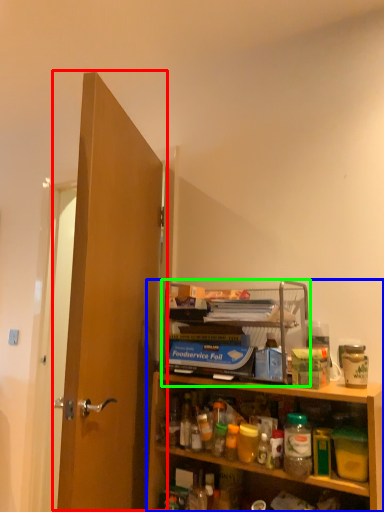
Question: Based on their relative distances, which object is farther from door (highlighted by a red box)? Choose from cabinetry (highlighted by a blue box) and shelf (highlighted by a green box).

Choices:
 (A) cabinetry
 (B) shelf

Answer: (A)